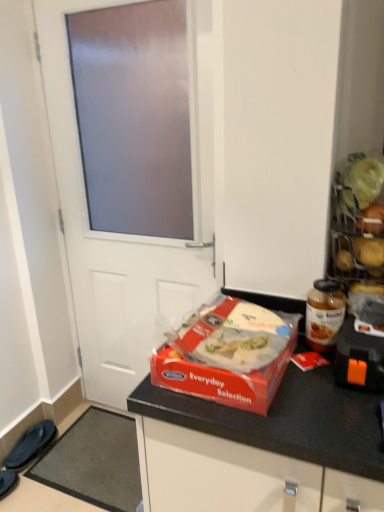
You are a GUI agent. You are given a task and a screenshot of the screen. Output one action in this format:
    pyautogui.click(x=<x>, y=<y>)
    Task: Click on the translucent glass jar at right
    
    Given the screenshot: What is the action you would take?
    pyautogui.click(x=324, y=314)

You are a GUI agent. You are given a task and a screenshot of the screen. Output one action in this format:
    pyautogui.click(x=<x>, y=<y>)
    Task: Click on the gray carpet at lower left
    The height and width of the screenshot is (512, 384).
    Given the screenshot: What is the action you would take?
    pyautogui.click(x=95, y=461)

Based on the photo, measure the distance between point (45, 472) and camera.

The distance of point (45, 472) from camera is 1.88 meters.

Identify the location of red matte plastic box of food at center. (232, 336).

Identify the location of dark blue fabric slippers at lower left, the second footwear viewed from the back. This screenshot has width=384, height=512. (7, 481).

This screenshot has height=512, width=384. I want to click on white matte door at center, so click(131, 170).

The width and height of the screenshot is (384, 512). In order to click on translucent glass jar at right in this screenshot , I will do `click(324, 314)`.

Image resolution: width=384 pixels, height=512 pixels. Find the location of `footwear below the gray carpet at lower left (from the image's perspective)`. footwear below the gray carpet at lower left (from the image's perspective) is located at coordinates [7, 481].

From the image's perspective, is dark blue fabric slippers at lower left, the second footwear viewed from the back, under gray carpet at lower left?

Correct, dark blue fabric slippers at lower left, the second footwear viewed from the back, appears lower than gray carpet at lower left in the image.

Are dark blue fabric slippers at lower left, which is counted as the first footwear, starting from the front, and gray carpet at lower left far apart?

They are positioned close to each other.

Which object is wider, dark blue fabric slippers at lower left, which is counted as the first footwear, starting from the front, or gray carpet at lower left?

gray carpet at lower left.

From a real-world perspective, is dark blue fabric slippers at lower left, which is counted as the first footwear, starting from the front, under white matte door at center?

Indeed, from a real-world perspective, dark blue fabric slippers at lower left, which is counted as the first footwear, starting from the front, is positioned beneath white matte door at center.

Between point (7, 485) and point (185, 169), which one is positioned in front?

The point (185, 169) is closer.

Is dark blue fabric slippers at lower left, which is counted as the first footwear, starting from the front, taller than white matte door at center?

No, dark blue fabric slippers at lower left, which is counted as the first footwear, starting from the front, is not taller than white matte door at center.

Is gray carpet at lower left taller or shorter than dark blue fabric slippers at lower left, the second footwear viewed from the back?

Considering their sizes, gray carpet at lower left has less height than dark blue fabric slippers at lower left, the second footwear viewed from the back.

From the image's perspective, relative to dark blue fabric slippers at lower left, the second footwear viewed from the back, is gray carpet at lower left above or below?

Clearly, from the image's perspective, gray carpet at lower left is above dark blue fabric slippers at lower left, the second footwear viewed from the back.

Based on their positions, is gray carpet at lower left located to the left or right of dark blue fabric slippers at lower left, which is counted as the first footwear, starting from the front?

In the image, gray carpet at lower left appears on the right side of dark blue fabric slippers at lower left, which is counted as the first footwear, starting from the front.

Can you tell me how much gray carpet at lower left and dark blue fabric slippers at lower left, the second footwear viewed from the back, differ in facing direction?

89.9 degrees.

Is point (30, 436) less distant than point (171, 342)?

No.

Considering the relative positions of black fabric slipper at lower left, the first footwear when ordered from back to front, and red matte plastic box of food at center in the image provided, is black fabric slipper at lower left, the first footwear when ordered from back to front, to the right of red matte plastic box of food at center from the viewer's perspective?

No, black fabric slipper at lower left, the first footwear when ordered from back to front, is not to the right of red matte plastic box of food at center.

Is black fabric slipper at lower left, which is the 2th footwear from front to back, facing towards red matte plastic box of food at center?

No.

Which of these two, black fabric slipper at lower left, the first footwear when ordered from back to front, or red matte plastic box of food at center, stands taller?

black fabric slipper at lower left, the first footwear when ordered from back to front.

Which object is wider, white matte door at center or dark blue fabric slippers at lower left, which is counted as the first footwear, starting from the front?

Wider between the two is dark blue fabric slippers at lower left, which is counted as the first footwear, starting from the front.

Can you tell me how much white matte door at center and dark blue fabric slippers at lower left, which is counted as the first footwear, starting from the front, differ in facing direction?

The angular difference between white matte door at center and dark blue fabric slippers at lower left, which is counted as the first footwear, starting from the front, is 90.2 degrees.

In order to click on door above the dark blue fabric slippers at lower left, the second footwear viewed from the back (from the image's perspective) in this screenshot , I will do `click(131, 170)`.

Considering the sizes of objects white matte door at center and dark blue fabric slippers at lower left, which is counted as the first footwear, starting from the front, in the image provided, who is shorter, white matte door at center or dark blue fabric slippers at lower left, which is counted as the first footwear, starting from the front,?

dark blue fabric slippers at lower left, which is counted as the first footwear, starting from the front.

Which object is further away from the camera, white matte door at center or gray carpet at lower left?

gray carpet at lower left is behind.

Which is in front, point (82, 298) or point (111, 460)?

Positioned in front is point (111, 460).

From a real-world perspective, is white matte door at center physically below gray carpet at lower left?

Actually, white matte door at center is physically above gray carpet at lower left in the real world.

Considering the relative positions of red matte plastic box of food at center and white matte door at center in the image provided, is red matte plastic box of food at center to the right of white matte door at center from the viewer's perspective?

Yes, red matte plastic box of food at center is to the right of white matte door at center.

From a real-world perspective, which is physically above, red matte plastic box of food at center or white matte door at center?

red matte plastic box of food at center is physically above.

Between red matte plastic box of food at center and white matte door at center, which one has larger width?

red matte plastic box of food at center is wider.

Identify the location of doormat that appears above the dark blue fabric slippers at lower left, the second footwear viewed from the back (from the image's perspective). The image size is (384, 512). (95, 461).

Find the location of `door on the right of the dark blue fabric slippers at lower left, which is counted as the first footwear, starting from the front`. door on the right of the dark blue fabric slippers at lower left, which is counted as the first footwear, starting from the front is located at coordinates (131, 170).

When comparing their distances from translucent glass jar at right, does dark blue fabric slippers at lower left, which is counted as the first footwear, starting from the front, or red matte plastic box of food at center seem closer?

The object closer to translucent glass jar at right is red matte plastic box of food at center.

Based on the photo, when comparing their distances from white matte door at center, does dark blue fabric slippers at lower left, which is counted as the first footwear, starting from the front, or red matte plastic box of food at center seem closer?

red matte plastic box of food at center is positioned closer to the anchor white matte door at center.

Based on their spatial positions, is translucent glass jar at right or white matte door at center closer to dark blue fabric slippers at lower left, which is counted as the first footwear, starting from the front?

Among the two, white matte door at center is located nearer to dark blue fabric slippers at lower left, which is counted as the first footwear, starting from the front.

Estimate the real-world distances between objects in this image. Which object is closer to red matte plastic box of food at center, gray carpet at lower left or dark blue fabric slippers at lower left, which is counted as the first footwear, starting from the front?

gray carpet at lower left.

Estimate the real-world distances between objects in this image. Which object is closer to black fabric slipper at lower left, which is the 2th footwear from front to back, red matte plastic box of food at center or white matte door at center?

white matte door at center is positioned closer to the anchor black fabric slipper at lower left, which is the 2th footwear from front to back.

Which object lies further to the anchor point red matte plastic box of food at center, white matte door at center or black fabric slipper at lower left, which is the 2th footwear from front to back?

black fabric slipper at lower left, which is the 2th footwear from front to back, is positioned further to the anchor red matte plastic box of food at center.

Based on their spatial positions, is gray carpet at lower left or red matte plastic box of food at center further from dark blue fabric slippers at lower left, the second footwear viewed from the back?

Based on the image, red matte plastic box of food at center appears to be further to dark blue fabric slippers at lower left, the second footwear viewed from the back.

From the image, which object appears to be nearer to translucent glass jar at right, black fabric slipper at lower left, which is the 2th footwear from front to back, or gray carpet at lower left?

Based on the image, gray carpet at lower left appears to be nearer to translucent glass jar at right.

Identify the location of food situated between black fabric slipper at lower left, the first footwear when ordered from back to front, and translucent glass jar at right from left to right. The height and width of the screenshot is (512, 384). (232, 336).

The image size is (384, 512). Identify the location of food between white matte door at center and gray carpet at lower left from top to bottom. (232, 336).

The image size is (384, 512). In order to click on footwear between white matte door at center and dark blue fabric slippers at lower left, which is counted as the first footwear, starting from the front, in the vertical direction in this screenshot , I will do `click(30, 444)`.

What are the coordinates of `footwear between dark blue fabric slippers at lower left, which is counted as the first footwear, starting from the front, and gray carpet at lower left, in the horizontal direction` in the screenshot? It's located at (30, 444).